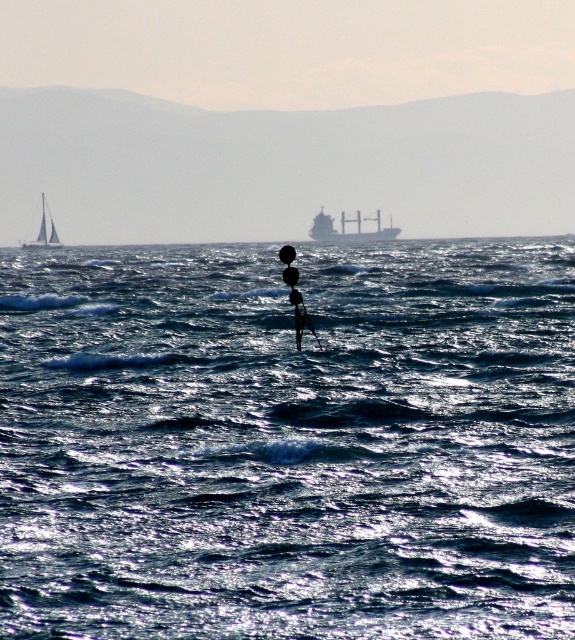
Question: Is smooth glass ocean at center further to camera compared to black plastic paddle at center?

Choices:
 (A) yes
 (B) no

Answer: (A)

Question: Which point is farther to the camera?

Choices:
 (A) (313, 336)
 (B) (63, 305)

Answer: (B)

Question: Which point is closer to the camera taking this photo?

Choices:
 (A) (200, 324)
 (B) (366, 237)

Answer: (A)

Question: Is metallic gray cargo ship at center thinner than white glossy sailboat at upper left?

Choices:
 (A) no
 (B) yes

Answer: (B)

Question: Does shiny blue water at center lie behind smooth glass ocean at center?

Choices:
 (A) yes
 (B) no

Answer: (B)

Question: Among these objects, which one is farthest from the camera?

Choices:
 (A) shiny blue water at center
 (B) metallic gray cargo ship at center
 (C) smooth glass ocean at center

Answer: (C)